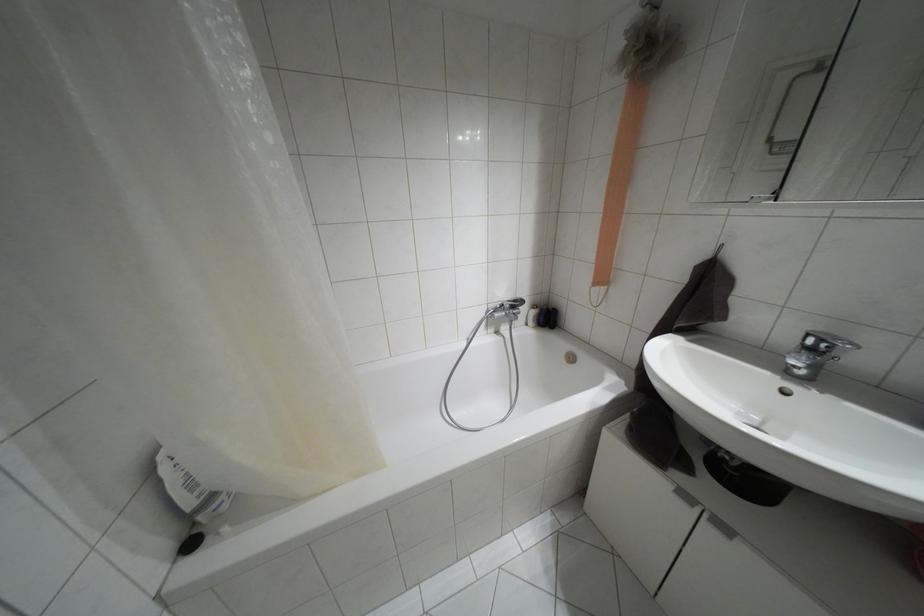
Identify the location of sink faucet handle. The height and width of the screenshot is (616, 924). (825, 341).